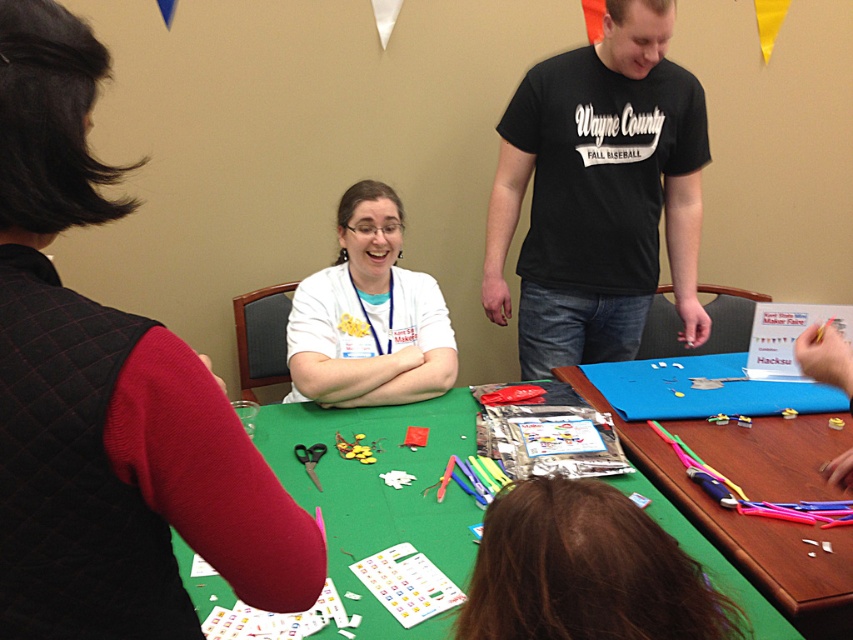
Question: In this image, where is green fabric table at center located relative to green fabric table at lower center?

Choices:
 (A) above
 (B) below

Answer: (A)

Question: Is green fabric table at center in front of green fabric table at lower center?

Choices:
 (A) no
 (B) yes

Answer: (B)

Question: Considering the real-world distances, which object is closest to the green fabric table at center?

Choices:
 (A) black cotton t-shirt at upper center
 (B) white matte shirt at center

Answer: (B)

Question: Which object is the closest to the white matte shirt at center?

Choices:
 (A) black cotton t-shirt at upper center
 (B) green fabric table at center
 (C) green fabric table at lower center

Answer: (B)

Question: Which of the following is the closest to the observer?

Choices:
 (A) green fabric table at lower center
 (B) black cotton t-shirt at upper center
 (C) green fabric table at center

Answer: (C)

Question: Can you confirm if black cotton t-shirt at upper center is positioned below green fabric table at center?

Choices:
 (A) yes
 (B) no

Answer: (B)